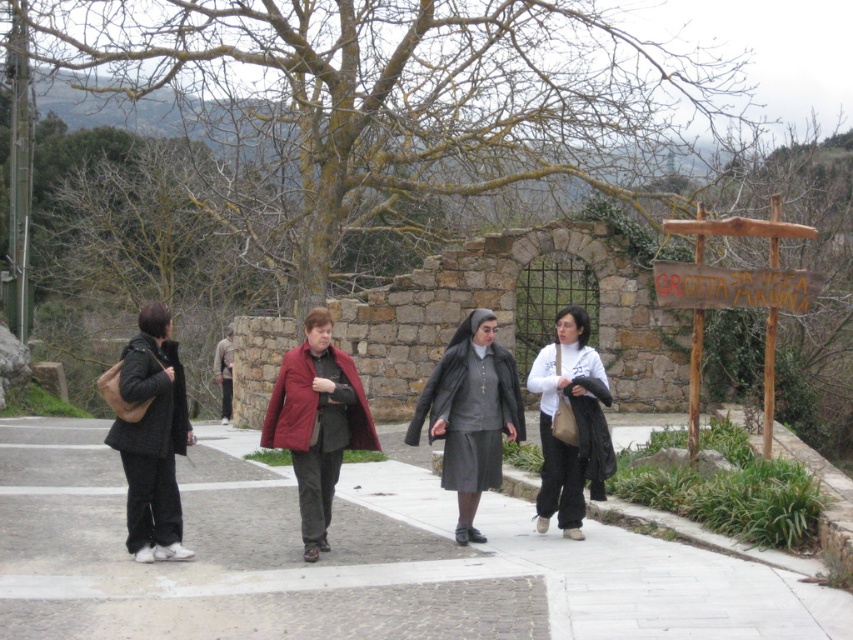
You are a tourist trying to find the signpost mentioned in your map. You see the white concrete pavement at lower center and the wooden sign at right. Which object is larger in size?

The white concrete pavement at lower center is bigger than the wooden sign at right, so the white concrete pavement at lower center is the larger object.

You are standing on the paved pathway in the scene and want to take a photo of both the wooden signpost with the text GROTTA S. VUCCA MANNA and the stone archway behind it. Which point, point (107, 500) or point (689, 392), should you stand closer to in order to capture both subjects in your frame?

You should stand closer to point (689, 392) because point (107, 500) is behind it, meaning that moving towards point (689, 392) will place the stone archway and the signpost within the same visual plane.